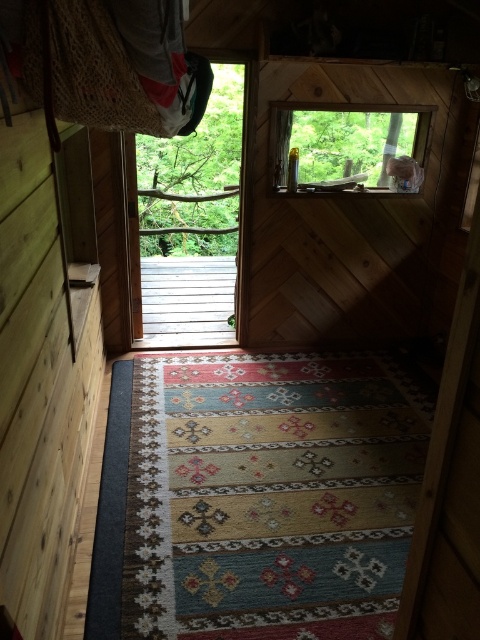
Does transparent glass door at left have a larger size compared to transparent glass window at upper center?

Correct, transparent glass door at left is larger in size than transparent glass window at upper center.

Is point (155, 232) closer to camera compared to point (307, 128)?

No.

Describe the element at coordinates (190, 220) in the screenshot. I see `transparent glass door at left` at that location.

This screenshot has width=480, height=640. I want to click on transparent glass door at left, so click(190, 220).